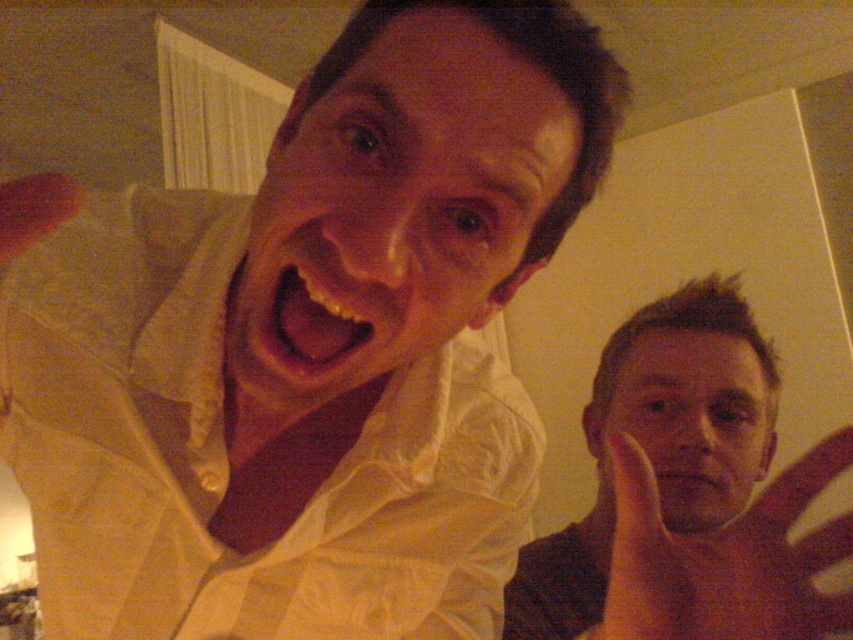
Between white glossy shirt at upper left and matte skin hand at lower right, which one is positioned lower?

matte skin hand at lower right is below.

Does point (61, 451) lie behind point (790, 637)?

Yes, point (61, 451) is farther from viewer.

At what (x,y) coordinates should I click in order to perform the action: click on white glossy shirt at upper left. Please return your answer as a coordinate pair (x, y). Image resolution: width=853 pixels, height=640 pixels. Looking at the image, I should click on (310, 348).